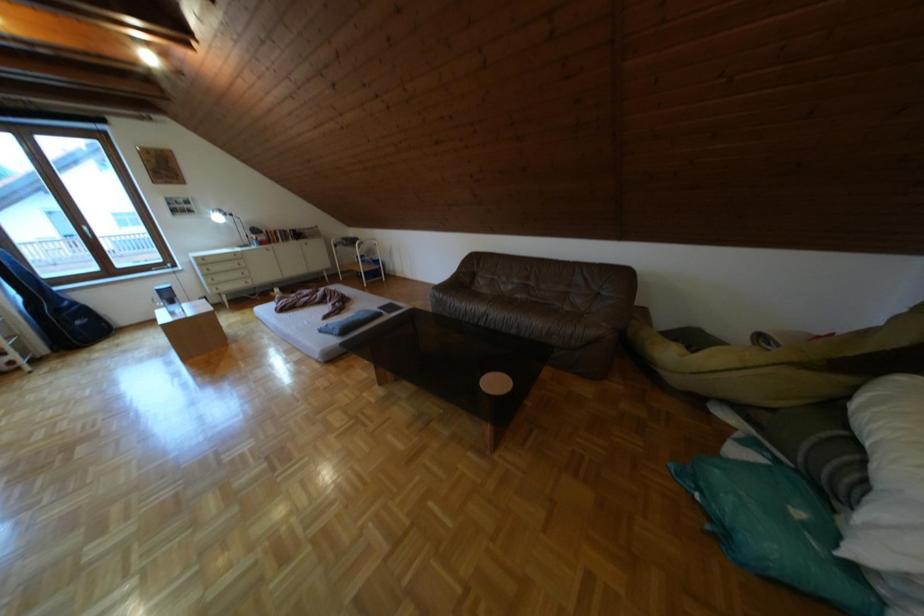
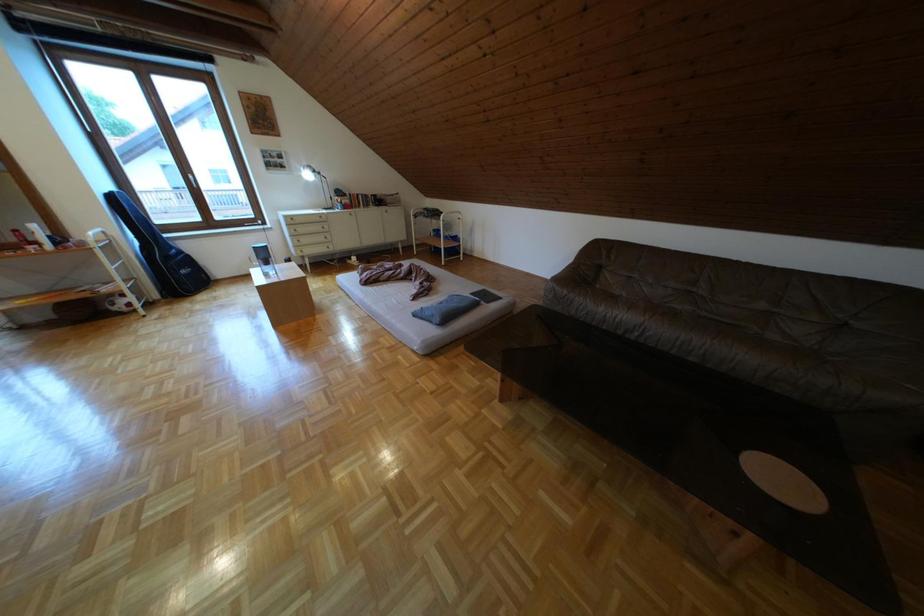
The images are taken continuously from a first-person perspective. In which direction are you moving?

The movement direction of the cameraman is left, forward.